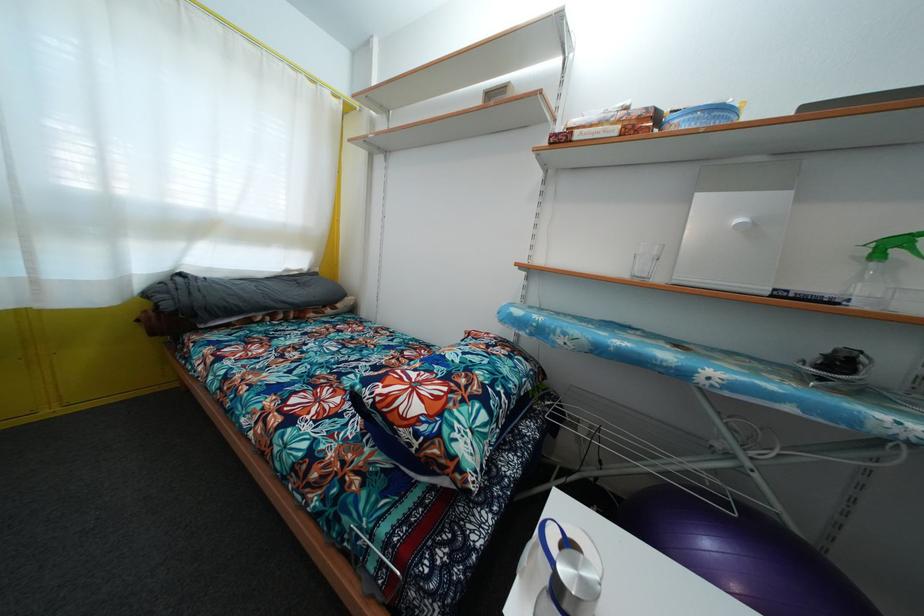
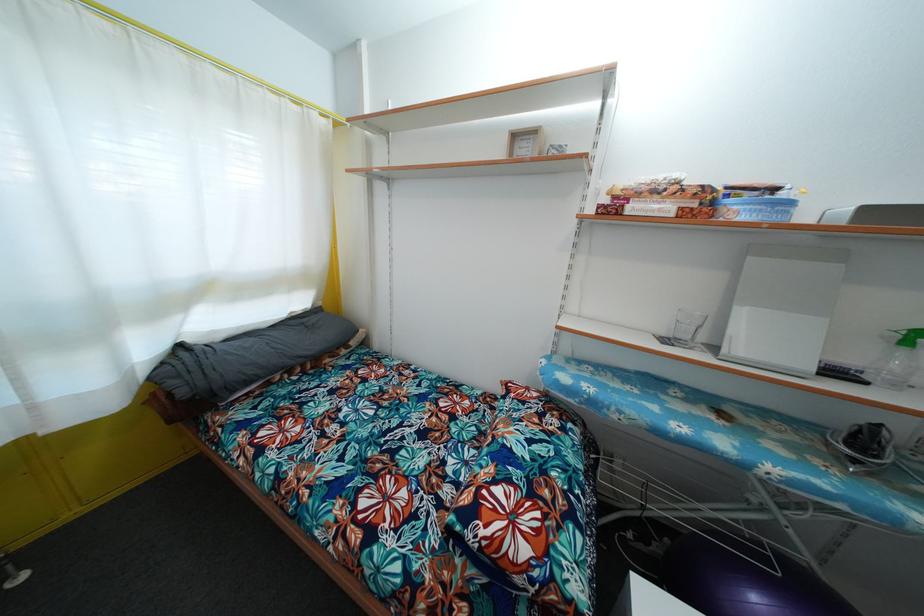
Question: The images are taken continuously from a first-person perspective. In which direction is your viewpoint rotating?

Choices:
 (A) Left
 (B) Right
 (C) Up
 (D) Down

Answer: (D)